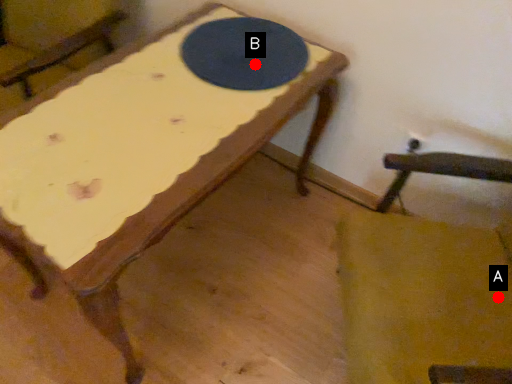
Question: Two points are circled on the image, labeled by A and B beside each circle. Among these points, which one is farthest from the camera?

Choices:
 (A) A is further
 (B) B is further

Answer: (B)